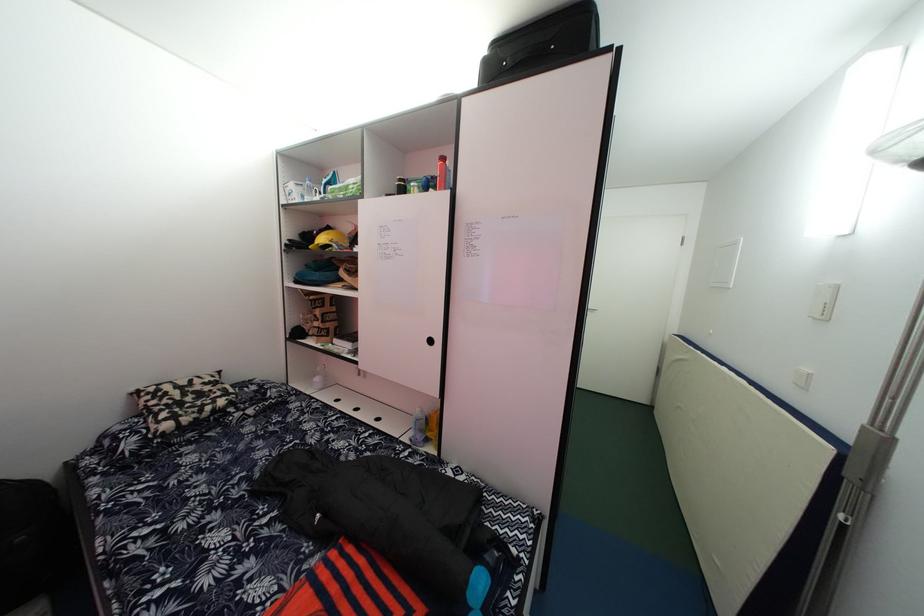
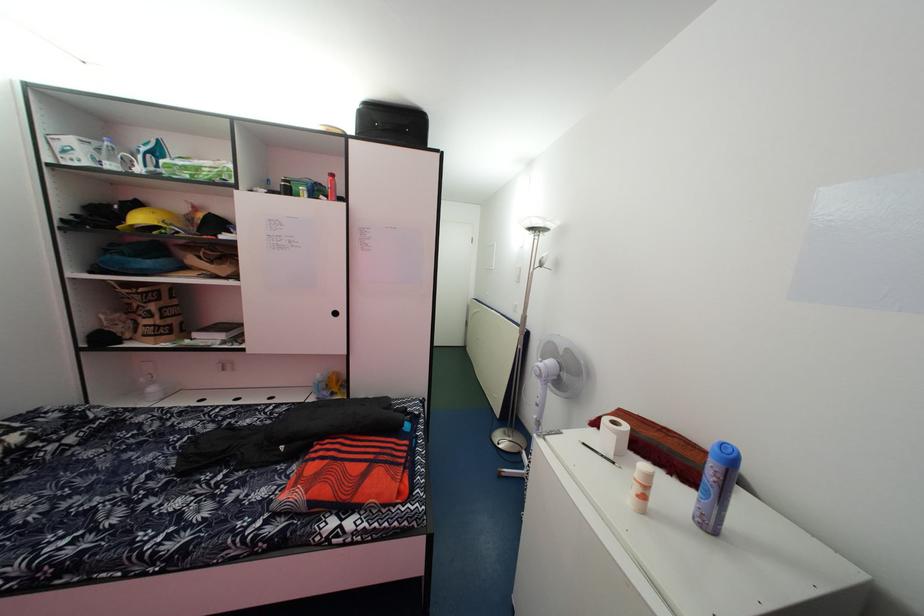
The point at (331, 246) is marked in the first image. Where is the corresponding point in the second image?

(149, 225)